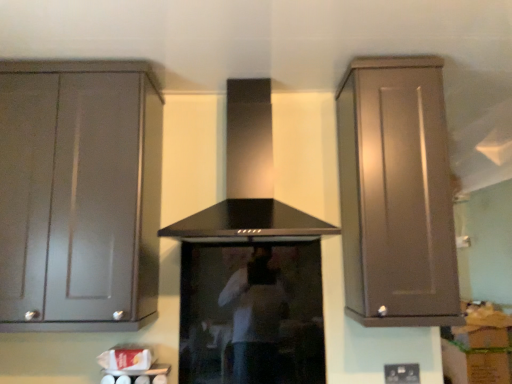
Question: Does matte gray cabinet at left, the 2th cabinetry viewed from the right, have a lesser height compared to black matte vent at center?

Choices:
 (A) yes
 (B) no

Answer: (B)

Question: Is matte gray cabinet at left, arranged as the first cabinetry when viewed from the left, next to black matte vent at center?

Choices:
 (A) yes
 (B) no

Answer: (B)

Question: Is matte gray cabinet at left, the 2th cabinetry viewed from the right, aimed at black matte vent at center?

Choices:
 (A) yes
 (B) no

Answer: (B)

Question: Is matte gray cabinet at left, arranged as the first cabinetry when viewed from the left, not near black matte vent at center?

Choices:
 (A) no
 (B) yes

Answer: (A)

Question: Does matte gray cabinet at left, arranged as the first cabinetry when viewed from the left, have a greater width compared to black matte vent at center?

Choices:
 (A) no
 (B) yes

Answer: (A)

Question: From the image's perspective, is matte gray cabinet at left, arranged as the first cabinetry when viewed from the left, under black matte vent at center?

Choices:
 (A) no
 (B) yes

Answer: (B)

Question: From a real-world perspective, does matte brown cabinet at right, marked as the 1th cabinetry in a right-to-left arrangement, sit lower than black glass stove at center?

Choices:
 (A) no
 (B) yes

Answer: (A)

Question: Is matte brown cabinet at right, which is counted as the 2th cabinetry, starting from the left, outside black glass stove at center?

Choices:
 (A) yes
 (B) no

Answer: (A)

Question: From the image's perspective, is matte brown cabinet at right, which is counted as the 2th cabinetry, starting from the left, under black glass stove at center?

Choices:
 (A) yes
 (B) no

Answer: (B)

Question: Is matte brown cabinet at right, marked as the 1th cabinetry in a right-to-left arrangement, beside black glass stove at center?

Choices:
 (A) yes
 (B) no

Answer: (B)

Question: Considering the relative sizes of matte brown cabinet at right, which is counted as the 2th cabinetry, starting from the left, and black glass stove at center in the image provided, is matte brown cabinet at right, which is counted as the 2th cabinetry, starting from the left, thinner than black glass stove at center?

Choices:
 (A) no
 (B) yes

Answer: (A)

Question: Is matte brown cabinet at right, which is counted as the 2th cabinetry, starting from the left, looking in the opposite direction of black glass stove at center?

Choices:
 (A) no
 (B) yes

Answer: (A)

Question: Can we say black matte vent at center lies outside black plastic electric outlet at lower center?

Choices:
 (A) yes
 (B) no

Answer: (A)